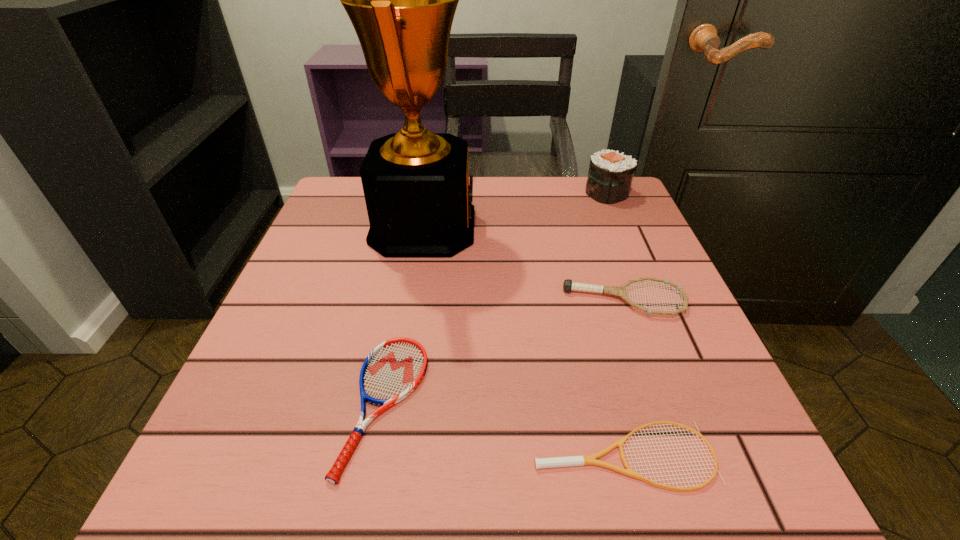
The height and width of the screenshot is (540, 960). I want to click on sushi present at the far edge, so click(x=610, y=175).

I want to click on object situated at the left edge, so click(x=401, y=0).

Locate an element on the screen. This screenshot has width=960, height=540. sushi positioned at the right edge is located at coordinates (610, 175).

Where is `object present at the far left corner`? object present at the far left corner is located at coordinates (401, 0).

Where is `object at the far right corner`? This screenshot has width=960, height=540. object at the far right corner is located at coordinates (610, 175).

Find the location of a particular element. The image size is (960, 540). object at the near right corner is located at coordinates (583, 460).

In the image, there is a desktop. Identify the location of free space at the far edge. (x=532, y=186).

In the image, there is a desktop. Where is `free region at the near edge`? free region at the near edge is located at coordinates (455, 507).

In the image, there is a desktop. Where is `vacant space at the left edge`? This screenshot has height=540, width=960. vacant space at the left edge is located at coordinates (305, 322).

Locate an element on the screen. The image size is (960, 540). free region at the right edge of the desktop is located at coordinates (581, 245).